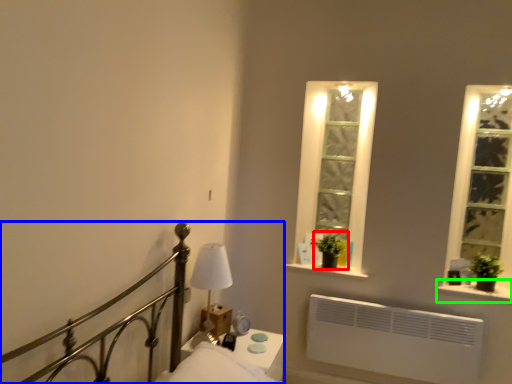
Question: Which is farther away from plant (highlighted by a red box)? bed (highlighted by a blue box) or window sill (highlighted by a green box)?

Choices:
 (A) bed
 (B) window sill

Answer: (A)